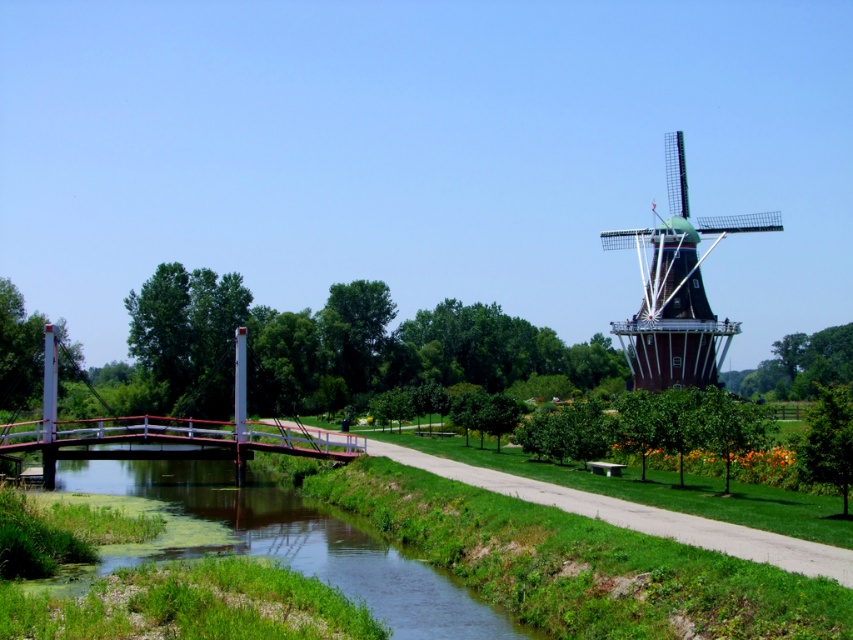
You are standing at the center of the scene and want to walk to the metallic bridge at left. Which direction should you head?

Since the metallic bridge at left is located at point (165, 429) in 2D coordinates, you should head to the left side of the scene to reach it.

You are planning to install a new bench exactly halfway between the green wooden windmill at right and the metallic bridge at left. How far will the bench be from each of these two landmarks in feet?

The bench will be placed exactly halfway between the green wooden windmill at right and the metallic bridge at left, so it will be 87.75 feet away from each since the total distance between them is 175.50 feet.